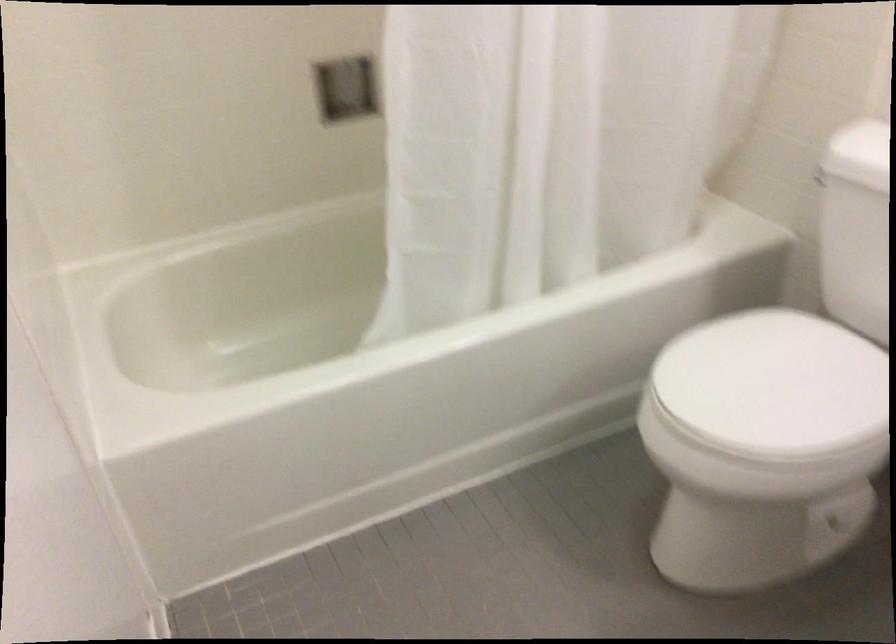
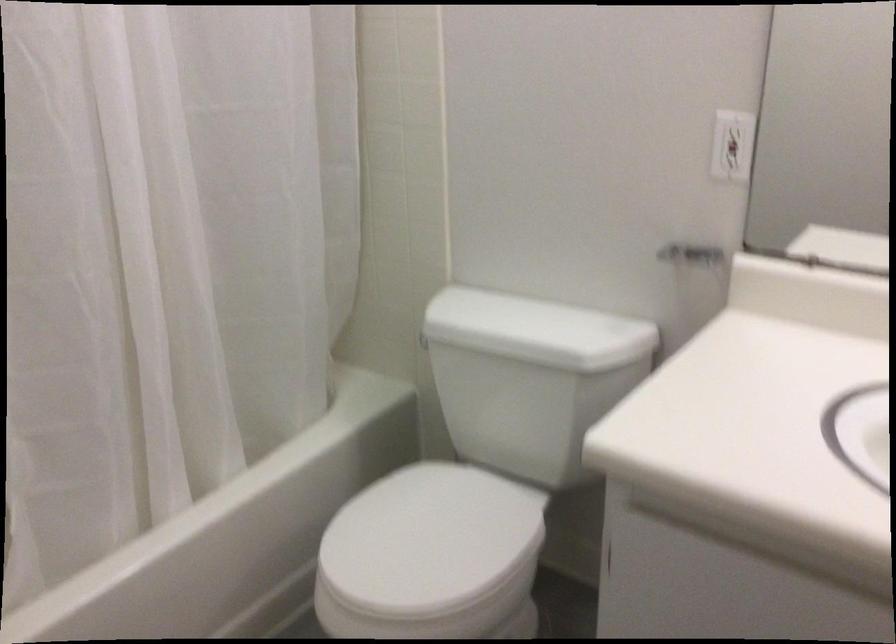
The point at (776, 389) is marked in the first image. Where is the corresponding point in the second image?

(429, 540)